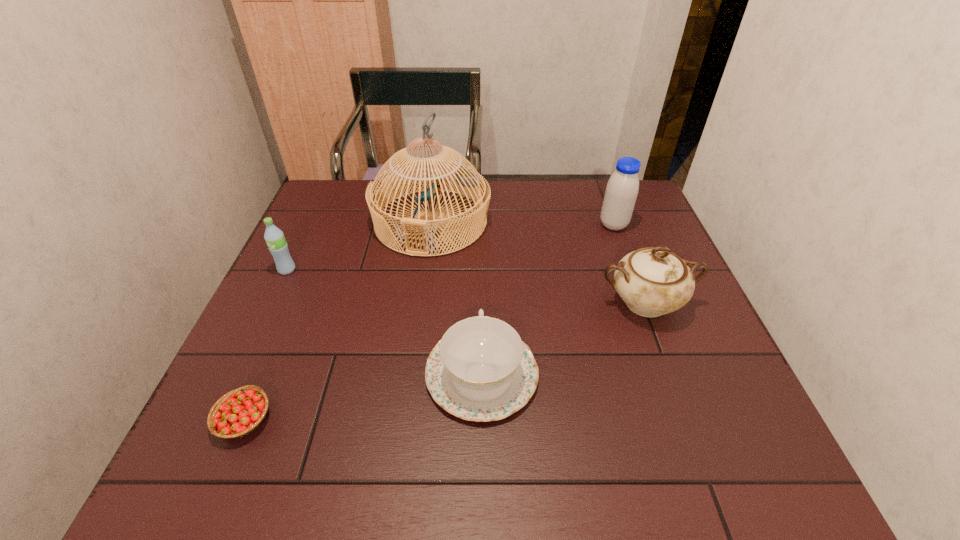
The height and width of the screenshot is (540, 960). What are the coordinates of `free space between the tallest object and the water bottle` in the screenshot? It's located at (359, 246).

This screenshot has height=540, width=960. I want to click on free point between the fourth farthest object and the shorter chinaware, so click(x=564, y=339).

Identify the location of free space between the strawberry and the nearer chinaware. The width and height of the screenshot is (960, 540). (363, 397).

Image resolution: width=960 pixels, height=540 pixels. Find the location of `vacant region between the strawberry and the soya milk`. vacant region between the strawberry and the soya milk is located at coordinates (429, 322).

Identify the location of empty location between the shorter chinaware and the third nearest object. (564, 339).

At what (x,y) coordinates should I click in order to perform the action: click on free area in between the soya milk and the birdcage. Please return your answer as a coordinate pair (x, y). The width and height of the screenshot is (960, 540). Looking at the image, I should click on (522, 224).

The height and width of the screenshot is (540, 960). I want to click on empty space between the water bottle and the left chinaware, so (384, 322).

Where is `vacant region between the left chinaware and the soya milk`? Image resolution: width=960 pixels, height=540 pixels. vacant region between the left chinaware and the soya milk is located at coordinates (547, 300).

Image resolution: width=960 pixels, height=540 pixels. I want to click on free spot between the soya milk and the shorter chinaware, so click(x=547, y=300).

The width and height of the screenshot is (960, 540). I want to click on the third closest object to the right chinaware, so click(x=466, y=178).